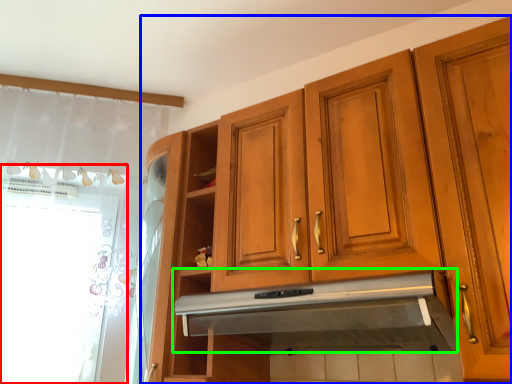
Question: Considering the real-world distances, which object is closest to window screen (highlighted by a red box)? cabinetry (highlighted by a blue box) or exhaust hood (highlighted by a green box).

Choices:
 (A) cabinetry
 (B) exhaust hood

Answer: (A)